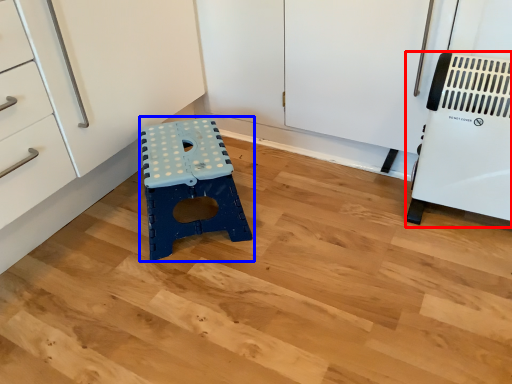
Question: Which object appears closest to the camera in this image, appliance (highlighted by a red box) or furniture (highlighted by a blue box)?

Choices:
 (A) appliance
 (B) furniture

Answer: (A)